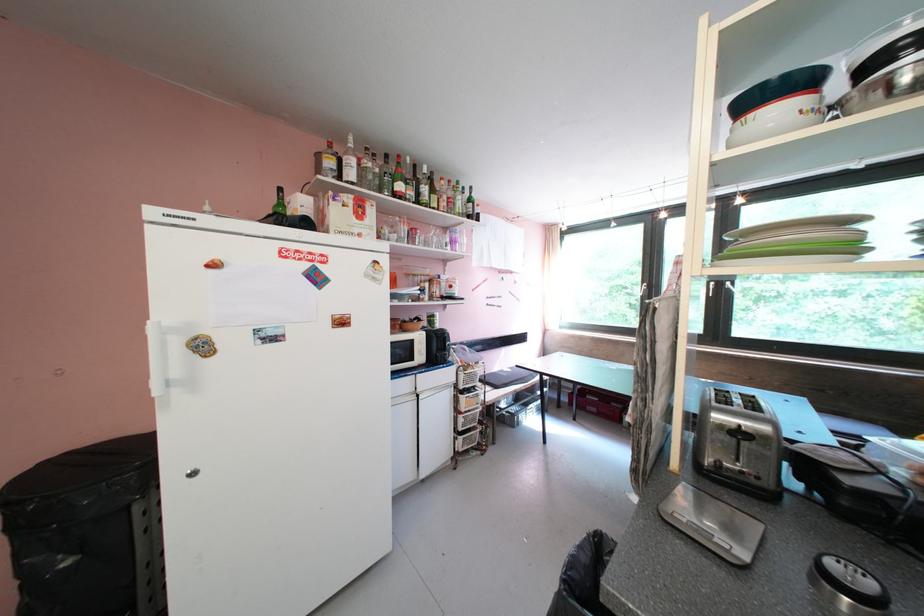
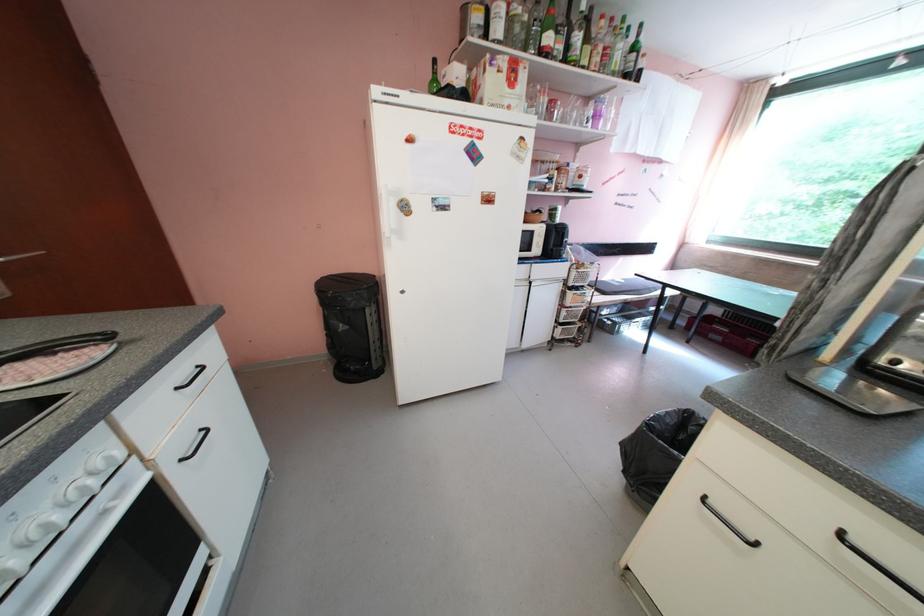
In the second image, find the point that corresponds to [468,440] in the first image.

(568, 330)